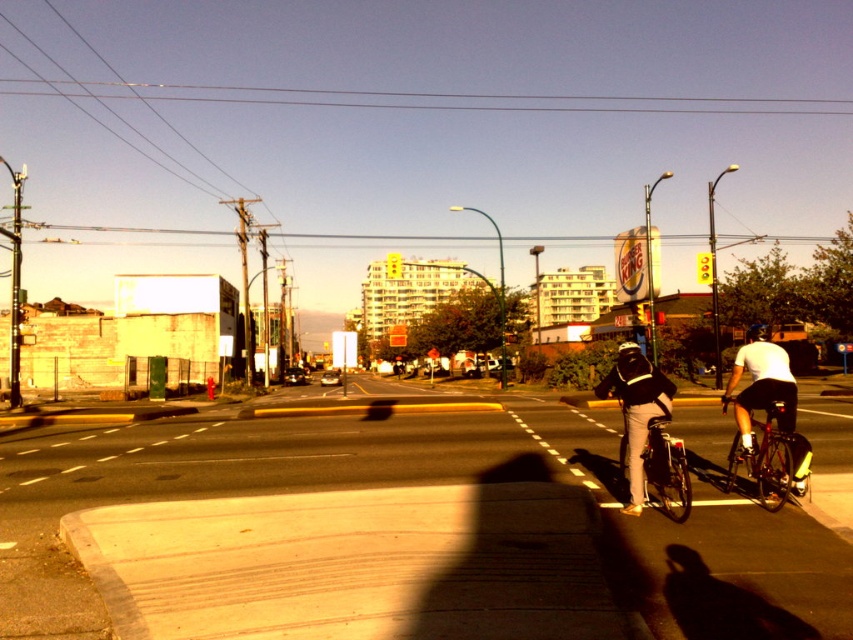
Question: Among these points, which one is nearest to the camera?

Choices:
 (A) (633, 438)
 (B) (733, 483)

Answer: (A)

Question: Observing the image, what is the correct spatial positioning of shiny black bicycle at center in reference to black matte bicycle helmet at center?

Choices:
 (A) above
 (B) below

Answer: (B)

Question: Which object appears closest to the camera in this image?

Choices:
 (A) black matte bicycle helmet at center
 (B) shiny black bicycle at center
 (C) shiny black bicycle at right

Answer: (B)

Question: Which of these objects is positioned farthest from the black matte bicycle helmet at center?

Choices:
 (A) shiny black bicycle at center
 (B) shiny black bicycle at right

Answer: (B)

Question: Considering the relative positions of shiny black bicycle at center and black matte bicycle helmet at center in the image provided, where is shiny black bicycle at center located with respect to black matte bicycle helmet at center?

Choices:
 (A) right
 (B) left

Answer: (B)

Question: From the image, what is the correct spatial relationship of shiny black bicycle at center in relation to black matte bicycle helmet at center?

Choices:
 (A) right
 (B) left

Answer: (B)